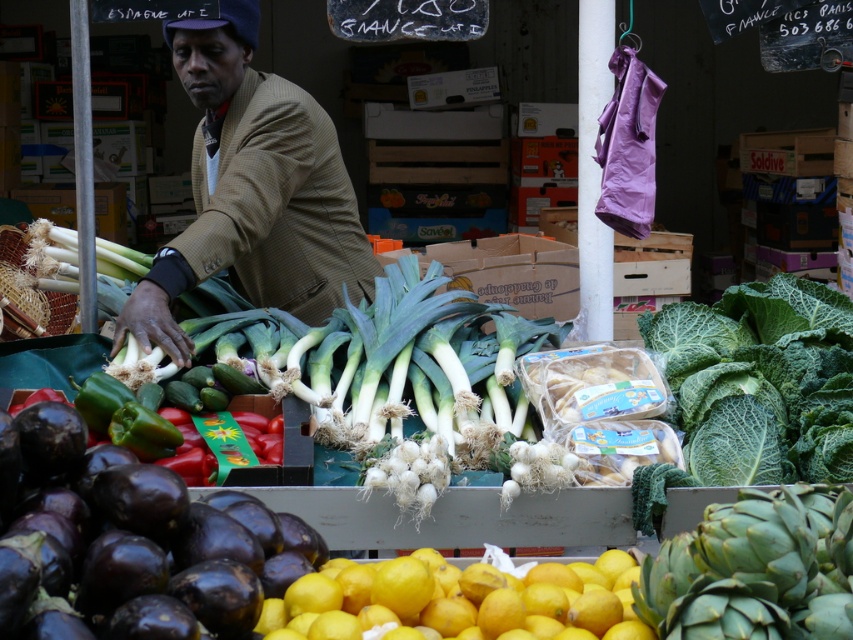
Does brown woolen jacket at center appear over yellow matte lemons at lower center?

Indeed, brown woolen jacket at center is positioned over yellow matte lemons at lower center.

Can you confirm if brown woolen jacket at center is smaller than yellow matte lemons at lower center?

Incorrect, brown woolen jacket at center is not smaller in size than yellow matte lemons at lower center.

The height and width of the screenshot is (640, 853). What are the coordinates of `brown woolen jacket at center` in the screenshot? It's located at (252, 189).

Who is lower down, brown woolen jacket at center or green leafy artichoke at lower right?

Positioned lower is green leafy artichoke at lower right.

Between brown woolen jacket at center and green leafy artichoke at lower right, which one is positioned higher?

Positioned higher is brown woolen jacket at center.

The height and width of the screenshot is (640, 853). In order to click on brown woolen jacket at center in this screenshot , I will do `click(252, 189)`.

Between point (674, 544) and point (577, 572), which one is positioned in front?

Point (674, 544)

Does green leafy artichoke at lower right have a lesser height compared to yellow matte lemons at lower center?

In fact, green leafy artichoke at lower right may be taller than yellow matte lemons at lower center.

Who is more forward, [724,602] or [288,628]?

Positioned in front is point [724,602].

Locate an element on the screen. This screenshot has height=640, width=853. green leafy artichoke at lower right is located at coordinates (755, 570).